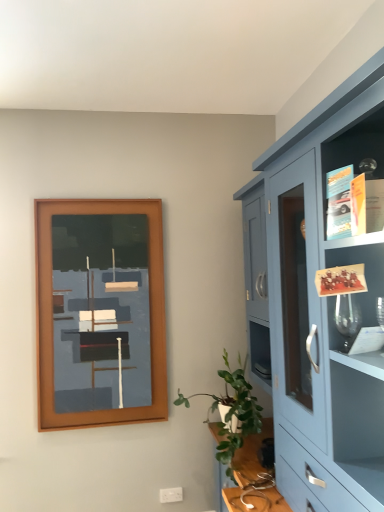
Question: Considering their positions, is matte blue cabinet at right located in front of or behind brown wooden picture frame at upper left?

Choices:
 (A) front
 (B) behind

Answer: (A)

Question: Based on their positions, is matte blue cabinet at right located to the left or right of brown wooden picture frame at upper left?

Choices:
 (A) left
 (B) right

Answer: (B)

Question: Which of these objects is positioned farthest from the matte blue cabinet at right?

Choices:
 (A) green leafy plant at lower right
 (B) brown wooden picture frame at upper left

Answer: (B)

Question: Estimate the real-world distances between objects in this image. Which object is closer to the brown wooden picture frame at upper left?

Choices:
 (A) matte blue cabinet at right
 (B) green leafy plant at lower right

Answer: (B)